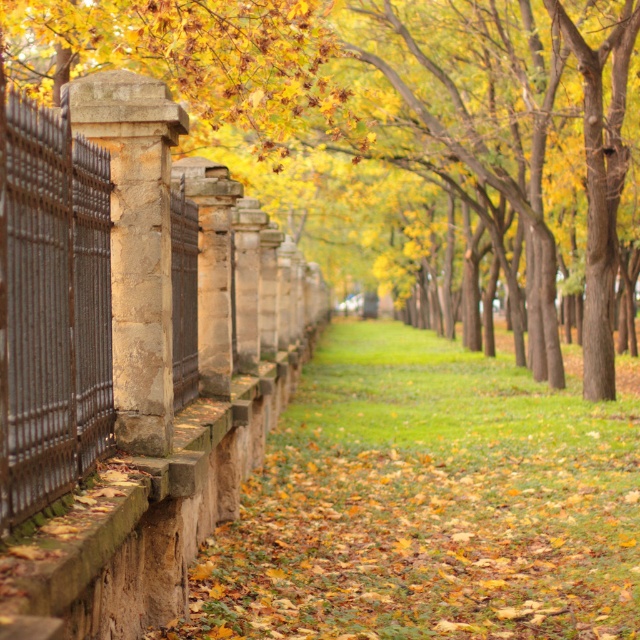
Question: Which of the following is the farthest from the observer?

Choices:
 (A) stone column at left
 (B) smooth stone pillar at left
 (C) yellow-green grass at center

Answer: (B)

Question: Does smooth stone pillar at left have a smaller size compared to stone column at left?

Choices:
 (A) yes
 (B) no

Answer: (B)

Question: Which point is farther from the camera taking this photo?

Choices:
 (A) (152, 257)
 (B) (636, 464)

Answer: (B)

Question: Which point is closer to the camera?

Choices:
 (A) (525, 83)
 (B) (122, 275)

Answer: (B)

Question: In this image, where is smooth stone pillar at left located relative to yellow-green grass at center?

Choices:
 (A) right
 (B) left

Answer: (B)

Question: Can you confirm if smooth stone pillar at left is positioned above yellow-green grass at center?

Choices:
 (A) no
 (B) yes

Answer: (B)